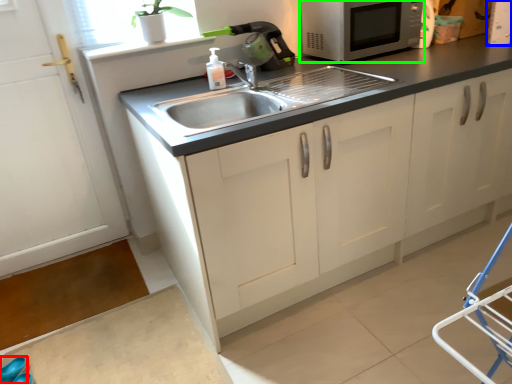
Question: Estimate the real-world distances between objects in this image. Which object is closer to shoe (highlighted by a red box), appliance (highlighted by a blue box) or microwave oven (highlighted by a green box)?

Choices:
 (A) appliance
 (B) microwave oven

Answer: (B)